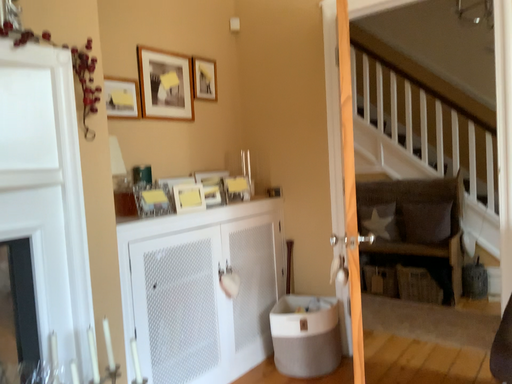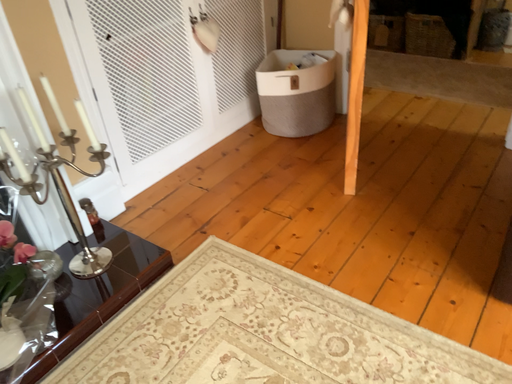
Question: Which way did the camera rotate in the video?

Choices:
 (A) rotated downward
 (B) rotated upward

Answer: (A)